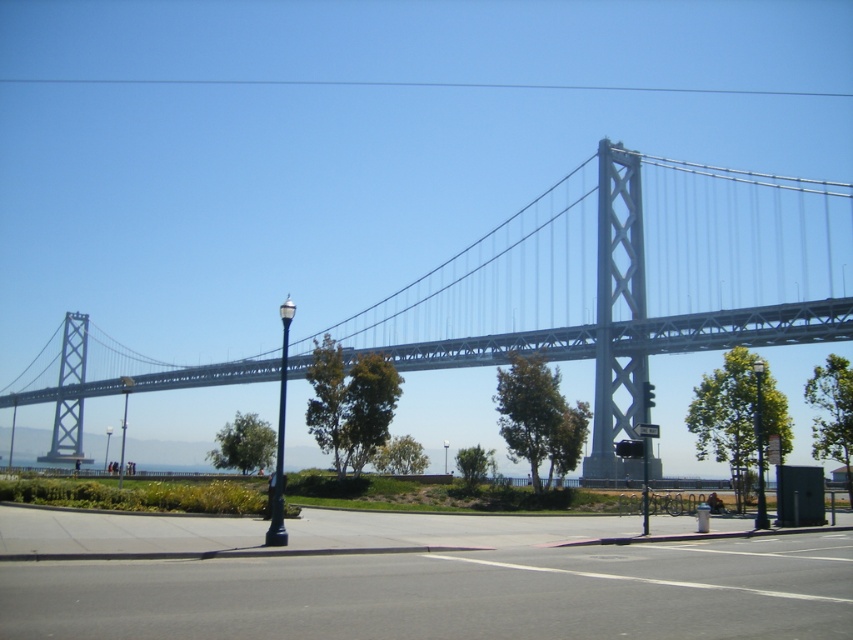
Is point (242, 365) closer to viewer compared to point (759, 492)?

That is False.

Does metallic gray bridge at center have a greater width compared to black metal lamp post at right?

Yes.

Who is more distant from viewer, (x=780, y=225) or (x=755, y=360)?

Point (x=780, y=225)

Image resolution: width=853 pixels, height=640 pixels. In order to click on metallic gray bridge at center in this screenshot , I will do `click(625, 278)`.

From the picture: Is polished metal streetlight at center wider than metallic streetlamp at center?

In fact, polished metal streetlight at center might be narrower than metallic streetlamp at center.

The width and height of the screenshot is (853, 640). What are the coordinates of `polished metal streetlight at center` in the screenshot? It's located at (280, 438).

Is point (277, 420) more distant than point (125, 424)?

No.

Find the location of `polished metal streetlight at center`. polished metal streetlight at center is located at coordinates (280, 438).

Is metallic streetlamp at center closer to the viewer compared to black metal lamp post at center?

Yes, it is.

Is metallic streetlamp at center positioned behind black metal lamp post at center?

No, metallic streetlamp at center is closer to the viewer.

Is point (122, 465) positioned before point (109, 433)?

Yes, point (122, 465) is in front of point (109, 433).

This screenshot has width=853, height=640. In order to click on metallic streetlamp at center in this screenshot , I will do `click(123, 422)`.